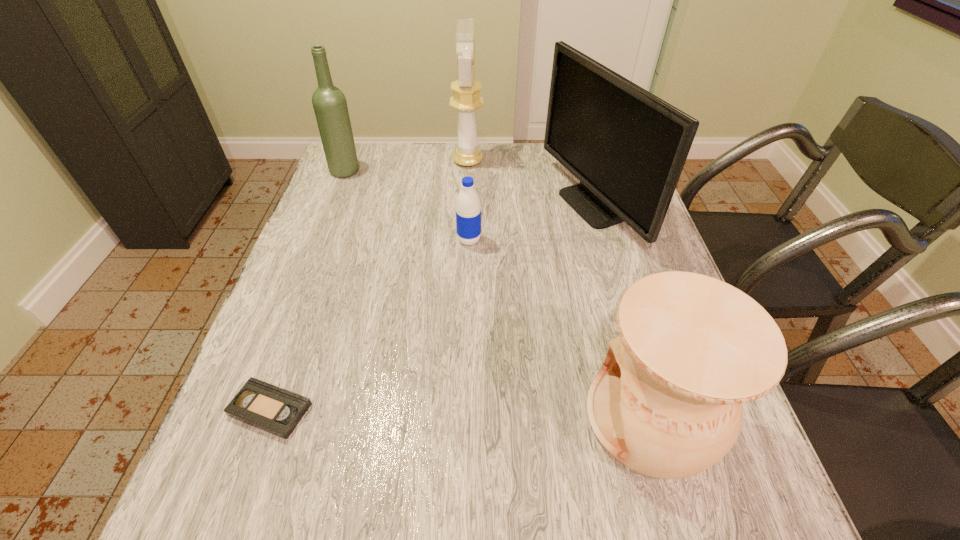
What are the coordinates of `wine bottle at the left edge` in the screenshot? It's located at (330, 106).

Where is `videotape situated at the left edge`? This screenshot has height=540, width=960. videotape situated at the left edge is located at coordinates (272, 409).

You are a GUI agent. You are given a task and a screenshot of the screen. Output one action in this format:
    pyautogui.click(x=<x>, y=<y>)
    Task: Click on the computer monitor that is positioned at the right edge
    
    Given the screenshot: What is the action you would take?
    pyautogui.click(x=627, y=147)

You are a GUI agent. You are given a task and a screenshot of the screen. Output one action in this format:
    pyautogui.click(x=<x>, y=<y>)
    Task: Click on the pottery located in the right edge section of the desktop
    
    Given the screenshot: What is the action you would take?
    pyautogui.click(x=667, y=403)

Locate an element on the screen. object positioned at the far left corner is located at coordinates click(x=330, y=106).

The height and width of the screenshot is (540, 960). What are the coordinates of `object present at the far right corner` in the screenshot? It's located at (627, 147).

Where is `object that is at the near right corner`? object that is at the near right corner is located at coordinates (667, 403).

This screenshot has height=540, width=960. In the image, there is a desktop. Find the location of `free space at the far edge`. free space at the far edge is located at coordinates (534, 163).

This screenshot has width=960, height=540. What are the coordinates of `vacant space at the near edge` in the screenshot? It's located at (461, 519).

The width and height of the screenshot is (960, 540). In the image, there is a desktop. In order to click on vacant space at the left edge in this screenshot , I will do `click(281, 332)`.